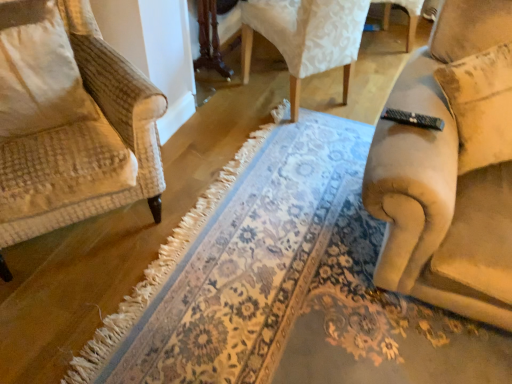
Where is `beige textured pillow at left`? Image resolution: width=512 pixels, height=384 pixels. beige textured pillow at left is located at coordinates (38, 71).

Locate an element on the screen. beige fabric couch at right, arranged as the first chair when viewed from the front is located at coordinates click(x=450, y=168).

From the picture: Does beige textured pillow at left have a larger size compared to floral carpet at center?

No.

Is floral carpet at center a part of beige textured pillow at left?

Definitely not — floral carpet at center is not inside beige textured pillow at left.

Is beige textured pillow at left turned away from floral carpet at center?

No.

Can you tell me how much beige textured pillow at left and floral carpet at center differ in facing direction?

beige textured pillow at left and floral carpet at center are facing 35.4 degrees away from each other.

How many degrees apart are the facing directions of beige fabric couch at right, arranged as the first chair when viewed from the front, and floral carpet at center?

46 degrees.

Can you confirm if beige fabric couch at right, arranged as the first chair when viewed from the front, is wider than floral carpet at center?

In fact, beige fabric couch at right, arranged as the first chair when viewed from the front, might be narrower than floral carpet at center.

Looking at the image, does beige fabric couch at right, the second chair in the back-to-front sequence, seem bigger or smaller compared to floral carpet at center?

beige fabric couch at right, the second chair in the back-to-front sequence, is smaller than floral carpet at center.

Which is more to the right, beige fabric couch at right, arranged as the first chair when viewed from the front, or floral carpet at center?

From the viewer's perspective, beige fabric couch at right, arranged as the first chair when viewed from the front, appears more on the right side.

I want to click on chair located above the beige textured pillow at left (from a real-world perspective), so (450, 168).

Does beige fabric couch at right, the second chair in the back-to-front sequence, touch beige textured pillow at left?

beige fabric couch at right, the second chair in the back-to-front sequence, and beige textured pillow at left are not in contact.

Looking at this image, how different are the orientations of beige fabric couch at right, arranged as the first chair when viewed from the front, and beige textured pillow at left in degrees?

beige fabric couch at right, arranged as the first chair when viewed from the front, and beige textured pillow at left are facing 10.5 degrees away from each other.

Considering the positions of point (451, 88) and point (50, 37), is point (451, 88) closer or farther from the camera than point (50, 37)?

Point (451, 88).

Is beige textured pillow at left next to beige fabric couch at right, arranged as the first chair when viewed from the front, and touching it?

No.

Looking at this image, does beige textured pillow at left appear on the left side of beige fabric couch at right, the second chair in the back-to-front sequence?

Indeed, beige textured pillow at left is positioned on the left side of beige fabric couch at right, the second chair in the back-to-front sequence.

Considering the positions of point (13, 136) and point (372, 170), is point (13, 136) closer or farther from the camera than point (372, 170)?

Point (13, 136) is positioned farther from the camera compared to point (372, 170).

Is beige textured pillow at left facing away from beige fabric couch at right, arranged as the first chair when viewed from the front?

beige textured pillow at left is not turned away from beige fabric couch at right, arranged as the first chair when viewed from the front.

From a real-world perspective, is beige fabric couch at right, arranged as the first chair when viewed from the front, below velvet-like beige chair at upper center, which appears as the 1th chair when viewed from the back?

Actually, beige fabric couch at right, arranged as the first chair when viewed from the front, is physically above velvet-like beige chair at upper center, which appears as the 1th chair when viewed from the back, in the real world.

Between beige fabric couch at right, the second chair in the back-to-front sequence, and velvet-like beige chair at upper center, which is the 2th chair in front-to-back order, which one has larger width?

velvet-like beige chair at upper center, which is the 2th chair in front-to-back order.

Image resolution: width=512 pixels, height=384 pixels. There is a velvet-like beige chair at upper center, which is the 2th chair in front-to-back order. What are the coordinates of `chair above it (from a real-world perspective)` in the screenshot? It's located at (450, 168).

Which is nearer, (320, 303) or (464, 68)?

The point (464, 68) is closer to the camera.

From the image's perspective, is floral carpet at center located above beige fabric couch at right, the second chair in the back-to-front sequence?

No.

Is beige fabric couch at right, arranged as the first chair when viewed from the front, at the back of floral carpet at center?

No.

Looking at their sizes, would you say floral carpet at center is wider or thinner than beige fabric couch at right, the second chair in the back-to-front sequence?

Considering their sizes, floral carpet at center looks broader than beige fabric couch at right, the second chair in the back-to-front sequence.

Is velvet-like beige chair at upper center, which appears as the 1th chair when viewed from the back, smaller than floral carpet at center?

Actually, velvet-like beige chair at upper center, which appears as the 1th chair when viewed from the back, might be larger than floral carpet at center.

Is velvet-like beige chair at upper center, which is the 2th chair in front-to-back order, with floral carpet at center?

No, velvet-like beige chair at upper center, which is the 2th chair in front-to-back order, is not next to floral carpet at center.

Is velvet-like beige chair at upper center, which is the 2th chair in front-to-back order, to the left of floral carpet at center from the viewer's perspective?

In fact, velvet-like beige chair at upper center, which is the 2th chair in front-to-back order, is to the right of floral carpet at center.

Could you tell me if velvet-like beige chair at upper center, which appears as the 1th chair when viewed from the back, is facing floral carpet at center?

No, velvet-like beige chair at upper center, which appears as the 1th chair when viewed from the back, is not aimed at floral carpet at center.

Where is `pillow to the left of floral carpet at center`? The height and width of the screenshot is (384, 512). pillow to the left of floral carpet at center is located at coordinates (38, 71).

You are a GUI agent. You are given a task and a screenshot of the screen. Output one action in this format:
    pyautogui.click(x=<x>, y=<y>)
    Task: Click on the chair that is the 2nd one above the floral carpet at center (from a real-world perspective)
    The image size is (512, 384).
    Given the screenshot: What is the action you would take?
    pyautogui.click(x=450, y=168)

From the image, which object appears to be nearer to velvet-like beige chair at upper center, which is the 2th chair in front-to-back order, beige textured pillow at left or floral carpet at center?

Among the two, floral carpet at center is located nearer to velvet-like beige chair at upper center, which is the 2th chair in front-to-back order.

Estimate the real-world distances between objects in this image. Which object is further from beige fabric couch at right, the second chair in the back-to-front sequence, floral carpet at center or beige textured pillow at left?

beige textured pillow at left.

Which object lies nearer to the anchor point floral carpet at center, beige fabric couch at right, arranged as the first chair when viewed from the front, or velvet-like beige chair at upper center, which appears as the 1th chair when viewed from the back?

Among the two, beige fabric couch at right, arranged as the first chair when viewed from the front, is located nearer to floral carpet at center.

Which object lies further to the anchor point beige fabric couch at right, the second chair in the back-to-front sequence, beige textured pillow at left or velvet-like beige chair at upper center, which is the 2th chair in front-to-back order?

Based on the image, beige textured pillow at left appears to be further to beige fabric couch at right, the second chair in the back-to-front sequence.

Based on their spatial positions, is beige textured pillow at left or beige fabric couch at right, arranged as the first chair when viewed from the front, closer to velvet-like beige chair at upper center, which is the 2th chair in front-to-back order?

Among the two, beige fabric couch at right, arranged as the first chair when viewed from the front, is located nearer to velvet-like beige chair at upper center, which is the 2th chair in front-to-back order.

In the scene shown: Estimate the real-world distances between objects in this image. Which object is closer to floral carpet at center, beige fabric couch at right, the second chair in the back-to-front sequence, or beige textured pillow at left?

Based on the image, beige fabric couch at right, the second chair in the back-to-front sequence, appears to be nearer to floral carpet at center.

Looking at the image, which one is located closer to velvet-like beige chair at upper center, which is the 2th chair in front-to-back order, floral carpet at center or beige fabric couch at right, arranged as the first chair when viewed from the front?

Based on the image, floral carpet at center appears to be nearer to velvet-like beige chair at upper center, which is the 2th chair in front-to-back order.

Considering their positions, is velvet-like beige chair at upper center, which appears as the 1th chair when viewed from the back, positioned closer to floral carpet at center than beige fabric couch at right, the second chair in the back-to-front sequence?

beige fabric couch at right, the second chair in the back-to-front sequence.

I want to click on doormat located between beige textured pillow at left and beige fabric couch at right, arranged as the first chair when viewed from the front, in the left-right direction, so click(279, 277).

Where is `pillow between velvet-like beige chair at upper center, which is the 2th chair in front-to-back order, and floral carpet at center vertically`? The height and width of the screenshot is (384, 512). pillow between velvet-like beige chair at upper center, which is the 2th chair in front-to-back order, and floral carpet at center vertically is located at coordinates (38, 71).

Identify the location of chair between velvet-like beige chair at upper center, which is the 2th chair in front-to-back order, and floral carpet at center vertically. The width and height of the screenshot is (512, 384). (450, 168).

Identify the location of chair between beige textured pillow at left and beige fabric couch at right, the second chair in the back-to-front sequence, in the horizontal direction. The width and height of the screenshot is (512, 384). (306, 37).